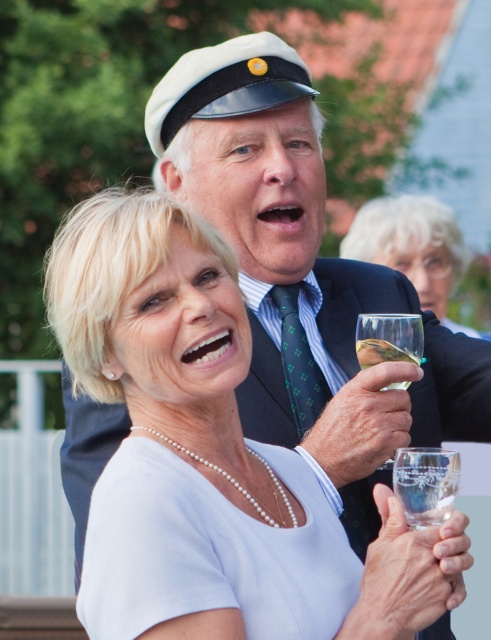
This screenshot has width=491, height=640. Find the location of `transparent glass at upper center`. transparent glass at upper center is located at coordinates (412, 248).

Between transparent glass at upper center and clear glass at lower right, which one appears on the right side from the viewer's perspective?

transparent glass at upper center

Does point (442, 220) come closer to viewer compared to point (410, 520)?

That is False.

At what (x,y) coordinates should I click in order to perform the action: click on transparent glass at upper center. Please return your answer as a coordinate pair (x, y). Looking at the image, I should click on (412, 248).

Who is positioned more to the right, clear glass at center or clear glass wine at right?

Positioned to the right is clear glass at center.

Between point (445, 634) and point (404, 360), which one is positioned in front?

Point (404, 360)

Image resolution: width=491 pixels, height=640 pixels. What do you see at coordinates (426, 483) in the screenshot?
I see `clear glass at center` at bounding box center [426, 483].

Locate an element on the screen. The width and height of the screenshot is (491, 640). clear glass at center is located at coordinates (426, 483).

Does clear glass wine glass at right appear on the left side of clear glass wine at right?

In fact, clear glass wine glass at right is to the right of clear glass wine at right.

Does clear glass wine glass at right have a lesser width compared to clear glass wine at right?

No.

This screenshot has width=491, height=640. In order to click on clear glass wine glass at right in this screenshot , I will do `click(388, 339)`.